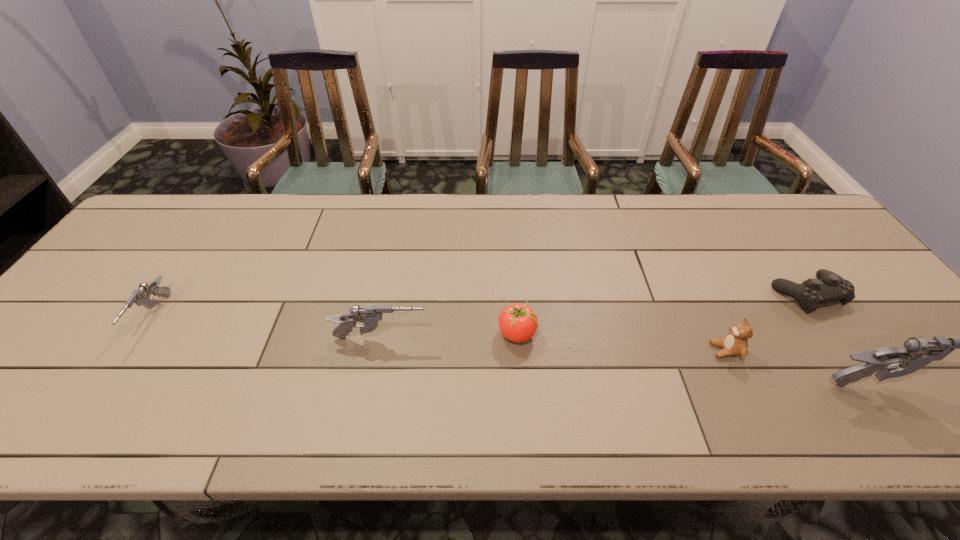
This screenshot has height=540, width=960. Identify the location of vacant point located 0.340m on the left of the third object from left to right. (354, 334).

Locate an element on the screen. The height and width of the screenshot is (540, 960). vacant space located on the front-facing side of the teddy bear is located at coordinates (565, 350).

At what (x,y) coordinates should I click in order to perform the action: click on vacant position located on the front-facing side of the teddy bear. Please return your answer as a coordinate pair (x, y). Looking at the image, I should click on (569, 350).

Locate an element on the screen. The image size is (960, 540). vacant region located on the front-facing side of the teddy bear is located at coordinates (578, 350).

Find the location of a particular element. The width and height of the screenshot is (960, 540). object located in the near edge section of the desktop is located at coordinates (735, 343).

This screenshot has height=540, width=960. Find the location of `object located at the right edge`. object located at the right edge is located at coordinates (828, 287).

Locate an element on the screen. free space at the far edge of the desktop is located at coordinates (509, 240).

In the image, there is a desktop. Where is `free region at the near edge`? The width and height of the screenshot is (960, 540). free region at the near edge is located at coordinates (544, 392).

The width and height of the screenshot is (960, 540). What are the coordinates of `free region at the left edge` in the screenshot? It's located at (151, 281).

Where is `blank area at the far left corner`? The width and height of the screenshot is (960, 540). blank area at the far left corner is located at coordinates (147, 240).